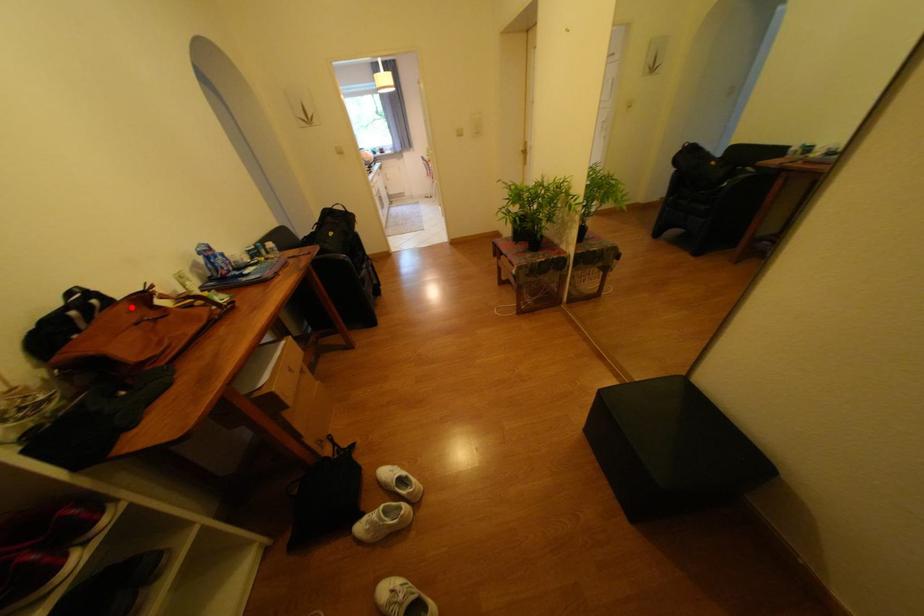
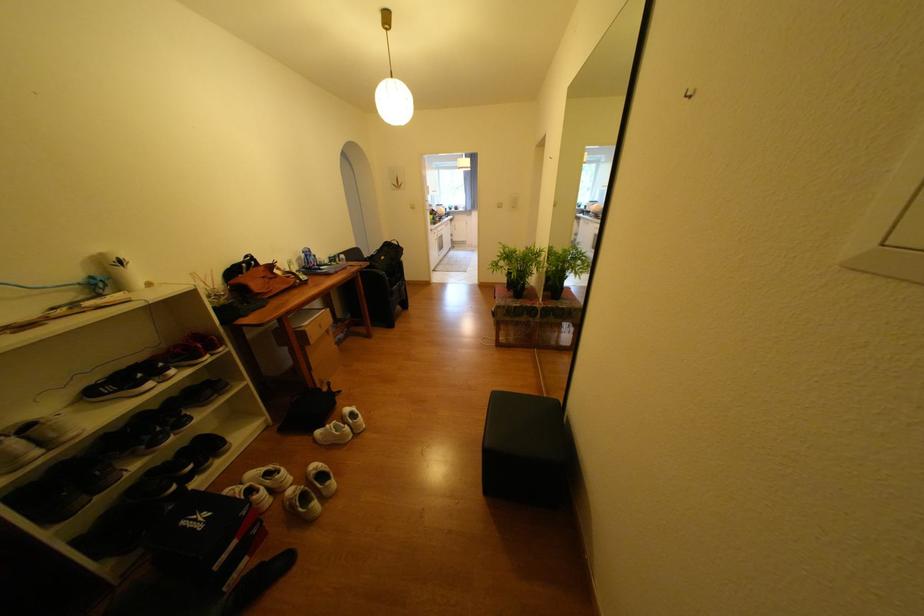
Question: I am providing you with two images of the same scene from different viewpoints. A red point is shown in image1. For the corresponding object point in image2, is it positioned nearer or farther from the camera?

Choices:
 (A) Nearer
 (B) Farther

Answer: (A)